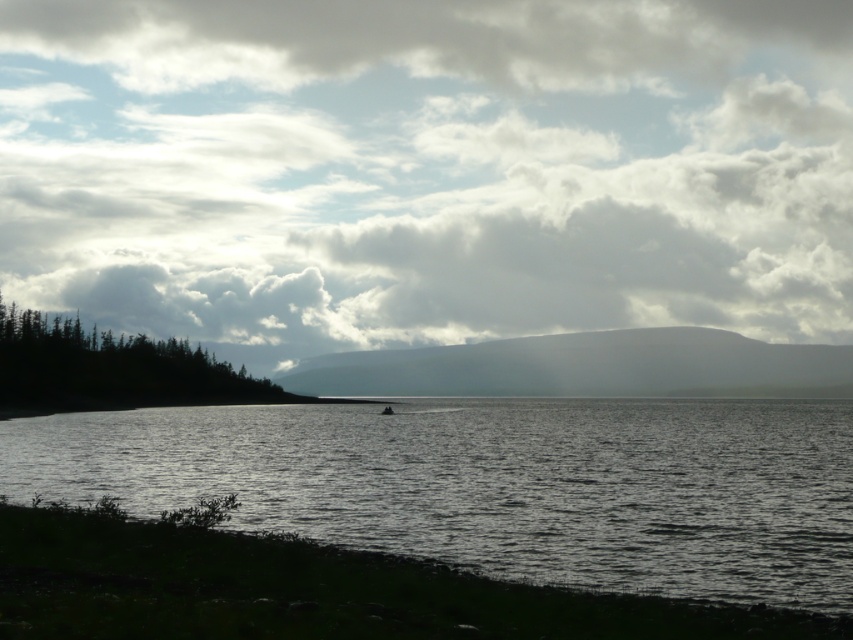
You are standing at the shoreline in the image and want to locate two points marked in the scene. The first point is at coordinates point (42, 452) and the second is at point (474, 593). Which point is closer to you?

Point (474, 593) is closer to you because it is in front of point (42, 452).